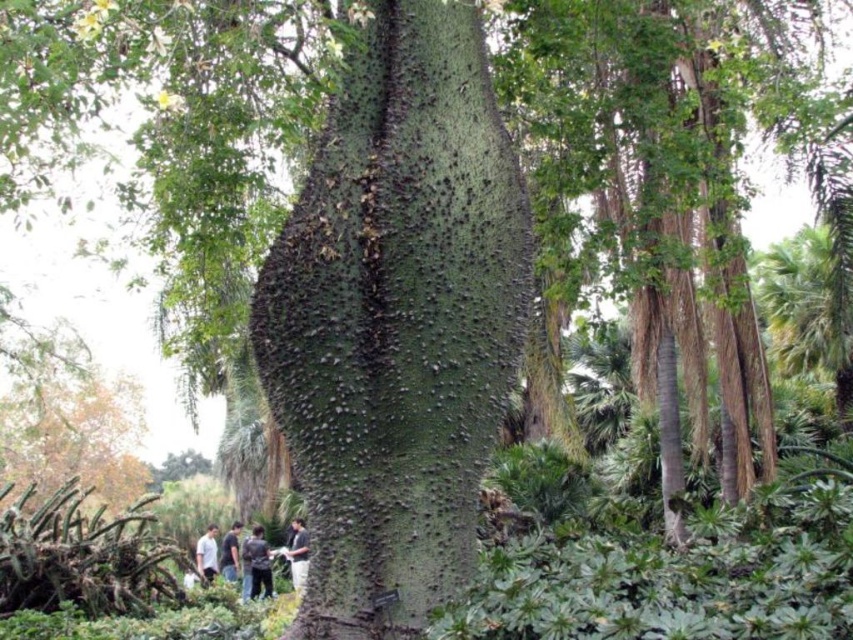
You are standing in the tropical garden looking at the large tree. There are two points marked on the tree trunk, one at coordinates point [300,563] and the other at point [236,579]. Which of these points is nearer to you?

Point [300,563] is closer to the viewer than point [236,579].

What is the color and texture of the clothing item located at point (297, 554) in the tropical garden scene?

The clothing item at point (297, 554) is a dark gray textured shirt.